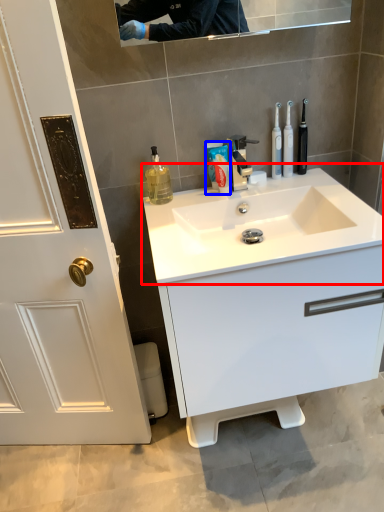
Question: Which object appears closest to the camera in this image, sink (highlighted by a red box) or toothpaste (highlighted by a blue box)?

Choices:
 (A) sink
 (B) toothpaste

Answer: (A)